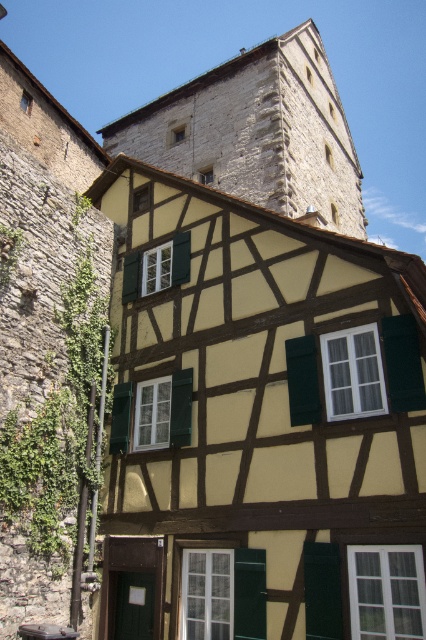
You are standing in front of the half timbered house and want to take a photo of the green matte shutter at center. To include the stone tower at upper center in the same frame, should you pan your camera to the left or right?

The stone tower at upper center is to the left of the green matte shutter at center. Therefore, to include the stone tower at upper center in the photo of the green matte shutter at center, you should pan your camera to the left.

You are a delivery drone with a wingspan of 1 meter. You need to fly between the stone tower at upper center and the green matte shutter at center to deliver a package. Can you safely pass through the gap without touching either structure?

The distance between the stone tower at upper center and the green matte shutter at center is 12.33 meters, which is significantly wider than the drone wingspan of 1 meter. Therefore, the drone can safely pass through the gap without touching either structure.

You are a tourist standing in front of the half timbered house and want to take a photo that includes both the stone tower at upper center and the green matte shutter at center. Which object should you focus on first to ensure both are in frame?

The stone tower at upper center is much taller than the green matte shutter at center, so you should focus on the stone tower at upper center first to ensure both are in frame.